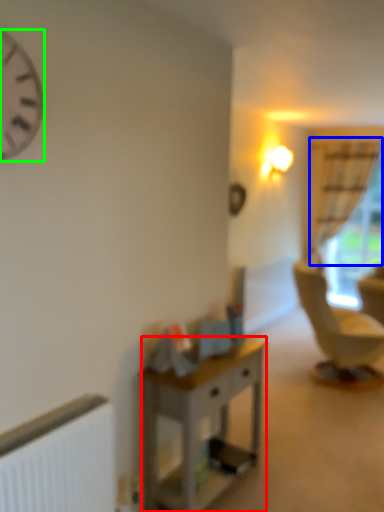
Question: Which is farther away from desk (highlighted by a red box)? curtain (highlighted by a blue box) or clock (highlighted by a green box)?

Choices:
 (A) curtain
 (B) clock

Answer: (A)